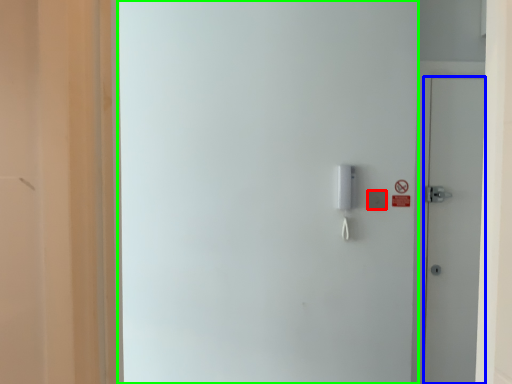
Question: Which object is positioned farthest from light switch (highlighted by a red box)? Select from door (highlighted by a blue box) and screen door (highlighted by a green box).

Choices:
 (A) door
 (B) screen door

Answer: (B)